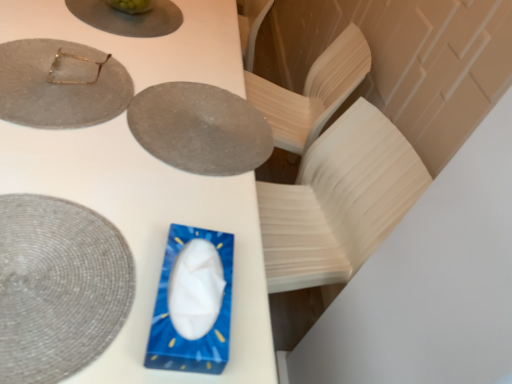
Where is `vacant space in between matte gray placemat at lower left, arranged as the 4th plate when viewed from the top, and matte gray placemat at upper left, which appears as the third plate when ordered from the bottom`? The height and width of the screenshot is (384, 512). vacant space in between matte gray placemat at lower left, arranged as the 4th plate when viewed from the top, and matte gray placemat at upper left, which appears as the third plate when ordered from the bottom is located at coordinates (86, 152).